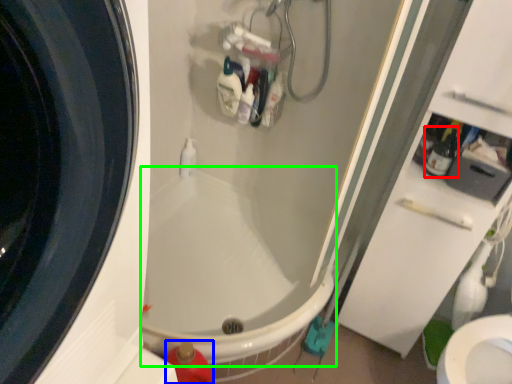
Question: Which object is positioned closest to bottle (highlighted by a red box)? Select from cleaning product (highlighted by a blue box) and bath (highlighted by a green box).

Choices:
 (A) cleaning product
 (B) bath

Answer: (B)